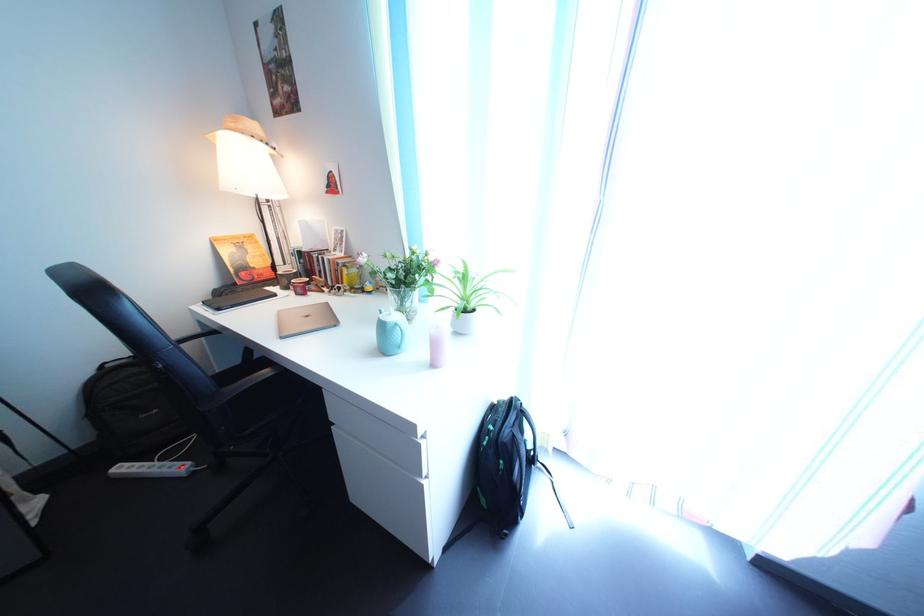
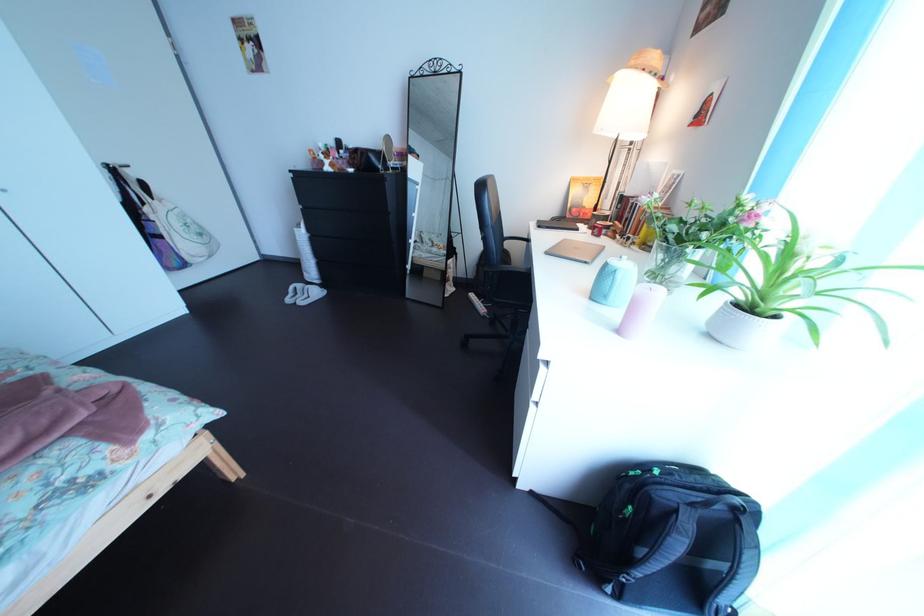
The point at (228, 339) is marked in the first image. Where is the corresponding point in the second image?

(541, 248)